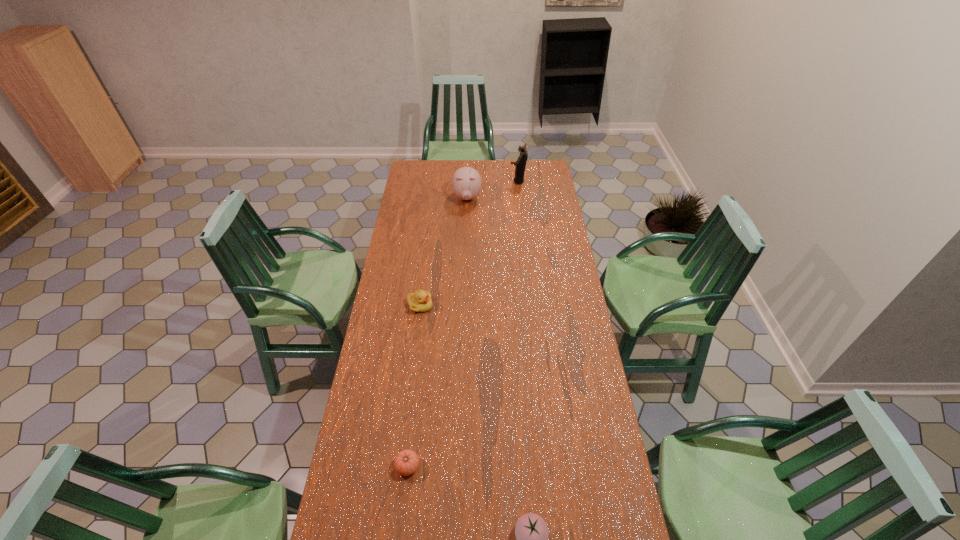
You are a GUI agent. You are given a task and a screenshot of the screen. Output one action in this format:
    pyautogui.click(x=<x>, y=<y>)
    Task: Click on the vacant space positioned 0.280m at the snout of the piggy bank
    
    Given the screenshot: What is the action you would take?
    pyautogui.click(x=466, y=242)

Image resolution: width=960 pixels, height=540 pixels. Find the location of `vacant space situated 0.140m on the front-facing side of the third nearest object`. vacant space situated 0.140m on the front-facing side of the third nearest object is located at coordinates (464, 306).

Where is `vacant space located on the back of the shorter tomato`? Image resolution: width=960 pixels, height=540 pixels. vacant space located on the back of the shorter tomato is located at coordinates (420, 356).

Locate an element on the screen. This screenshot has width=960, height=540. object that is at the far edge is located at coordinates (520, 165).

I want to click on object that is at the left edge, so 420,301.

Locate an element on the screen. This screenshot has width=960, height=540. vacant space at the far edge of the desktop is located at coordinates (441, 178).

This screenshot has height=540, width=960. I want to click on free space at the left edge of the desktop, so click(379, 325).

The image size is (960, 540). I want to click on free space at the right edge of the desktop, so click(x=560, y=361).

Locate an element on the screen. This screenshot has width=960, height=540. vacant area at the far left corner of the desktop is located at coordinates (421, 160).

I want to click on free space at the far right corner of the desktop, so click(535, 167).